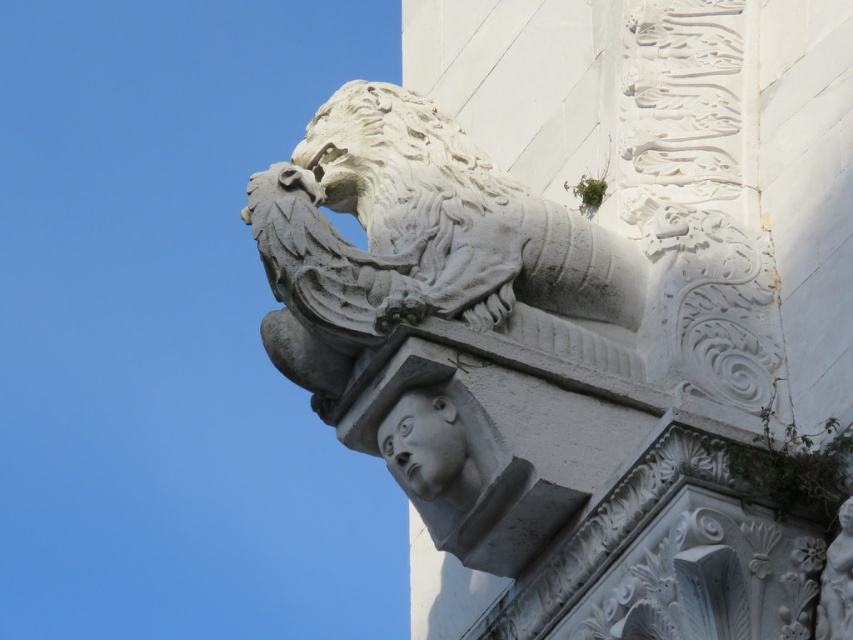
Is white stone lion at upper center above gray stone head at center?

Yes.

Which is in front, point (418, 180) or point (438, 388)?

Point (438, 388)

Image resolution: width=853 pixels, height=640 pixels. I want to click on white stone lion at upper center, so click(392, 157).